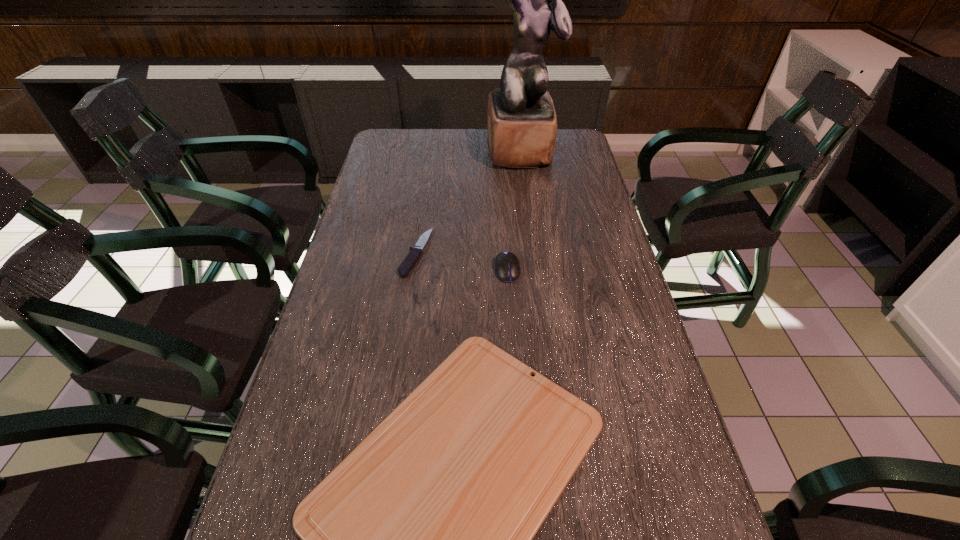
The image size is (960, 540). What are the coordinates of `the tallest object` in the screenshot? It's located at (521, 120).

I want to click on sculpture, so click(x=521, y=120).

Identify the location of the third shortest object. (507, 265).

Locate an element on the screen. steak knife is located at coordinates pos(411,259).

Find the location of a particular element. vacant space located in a relaxed pose on the sculpture is located at coordinates (531, 220).

Identify the location of vacant point located on the right of the computer mouse. Image resolution: width=960 pixels, height=540 pixels. (582, 270).

The width and height of the screenshot is (960, 540). I want to click on free point located 0.190m on the front of the steak knife, so click(403, 336).

Locate an element on the screen. This screenshot has width=960, height=540. object at the far edge is located at coordinates (521, 120).

Identify the location of object positioned at the right edge. The height and width of the screenshot is (540, 960). (521, 120).

The width and height of the screenshot is (960, 540). I want to click on object that is at the far right corner, so click(x=521, y=120).